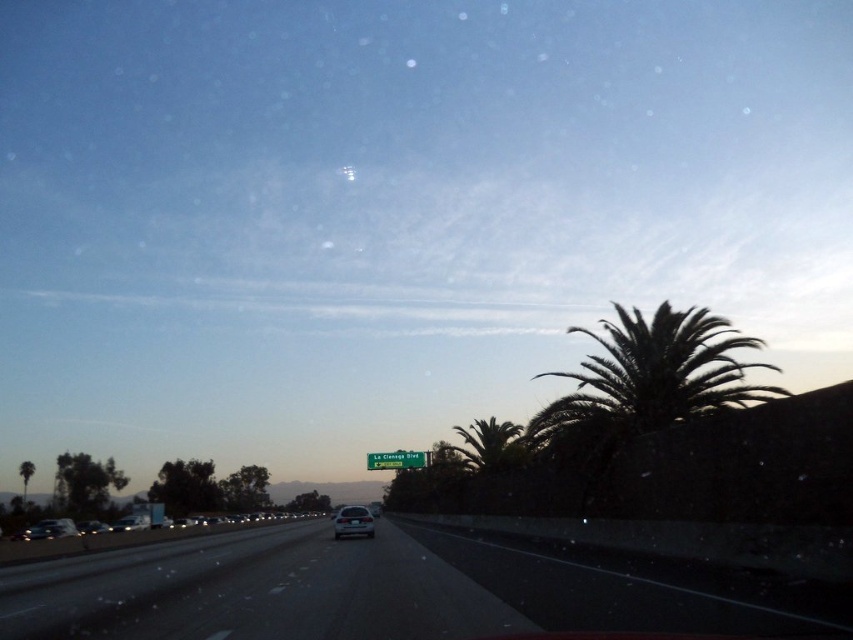
You are a drone operator trying to capture aerial footage of the highway scene. You need to determine which of the two points, point (381, 577) or point (514, 435), is closer to your camera position. Based on the scene description, which point should you focus on?

Point (381, 577) is closer to the camera than point (514, 435), so you should focus on point (381, 577).